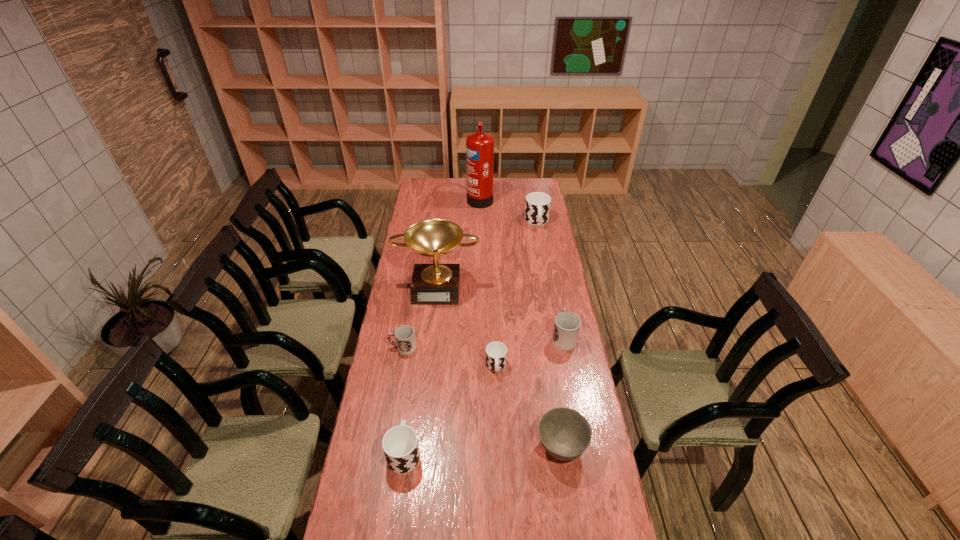
You are a GUI agent. You are given a task and a screenshot of the screen. Output one action in this format:
    pyautogui.click(x=<x>, y=<y>)
    Task: Click on the red fire extinguisher
    
    Given the screenshot: What is the action you would take?
    pyautogui.click(x=479, y=146)

Where is `the tallest object`? This screenshot has height=540, width=960. the tallest object is located at coordinates [479, 146].

At what (x,y) coordinates should I click in order to perform the action: click on the seventh shortest object. Please return your answer as a coordinate pair (x, y). Looking at the image, I should click on (432, 284).

Identify the location of award. (432, 284).

This screenshot has height=540, width=960. What are the coordinates of `the rightmost black cup` in the screenshot? It's located at (537, 208).

Locate an element on the screen. This screenshot has height=540, width=960. the biggest black cup is located at coordinates (537, 208).

Locate an element on the screen. The width and height of the screenshot is (960, 540). the right red cup is located at coordinates (566, 329).

You are a GUI agent. You are given a task and a screenshot of the screen. Output one action in this format:
    pyautogui.click(x=<x>, y=<y>)
    Task: Click on the leftmost black cup
    The width and height of the screenshot is (960, 540).
    Given the screenshot: What is the action you would take?
    [400, 445]

The image size is (960, 540). I want to click on the nearest black cup, so click(x=400, y=445).

The width and height of the screenshot is (960, 540). I want to click on bowl, so click(x=565, y=433).